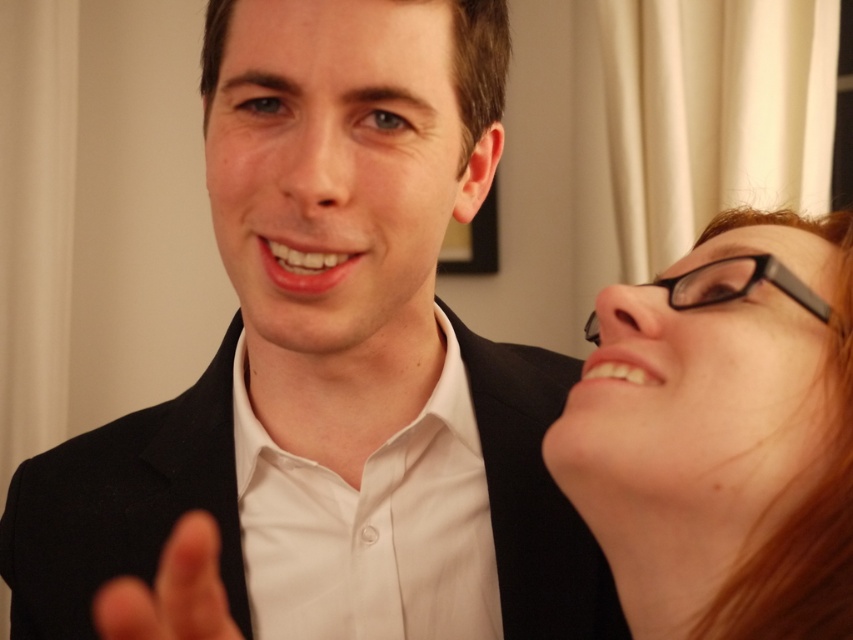
Is matte black glasses at upper right above matte black hand at center?

Yes, matte black glasses at upper right is above matte black hand at center.

Is matte black glasses at upper right taller than matte black hand at center?

Yes, matte black glasses at upper right is taller than matte black hand at center.

Which is behind, point (772, 595) or point (126, 580)?

Point (126, 580)

At what (x,y) coordinates should I click in order to perform the action: click on matte black glasses at upper right. Please return your answer as a coordinate pair (x, y). This screenshot has height=640, width=853. Looking at the image, I should click on (723, 435).

Which is in front, point (107, 595) or point (679, 291)?

Point (679, 291)

How far apart are matte black hand at center and black plastic glasses at upper right?

matte black hand at center is 11.45 inches away from black plastic glasses at upper right.

In order to click on matte black hand at center in this screenshot , I will do `click(172, 589)`.

Identify the location of matte black hand at center. (172, 589).

Is black matte suit at center further to camera compared to matte black hand at center?

Yes, it is.

Image resolution: width=853 pixels, height=640 pixels. Describe the element at coordinates (334, 348) in the screenshot. I see `black matte suit at center` at that location.

The image size is (853, 640). Find the location of `black matte suit at center`. black matte suit at center is located at coordinates (334, 348).